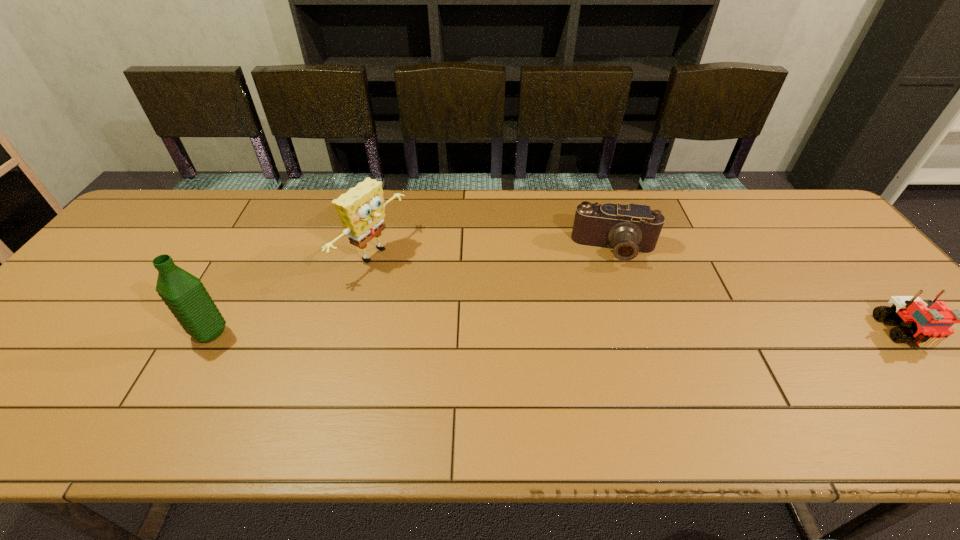
In order to click on water bottle in this screenshot , I will do `click(185, 295)`.

Where is `the rightmost object`? Image resolution: width=960 pixels, height=540 pixels. the rightmost object is located at coordinates (930, 323).

This screenshot has width=960, height=540. I want to click on the third object from left to right, so click(628, 229).

I want to click on the second object from left to right, so click(x=361, y=209).

Where is `vacant area situated 0.180m on the right of the water bottle`? This screenshot has height=540, width=960. vacant area situated 0.180m on the right of the water bottle is located at coordinates (x=303, y=333).

At what (x,y) coordinates should I click in order to perform the action: click on free space located on the front-facing side of the second object from right to left. Please return your answer as a coordinate pair (x, y). The height and width of the screenshot is (540, 960). Looking at the image, I should click on (612, 281).

At what (x,y) coordinates should I click in order to perform the action: click on free point located on the front-facing side of the second object from right to left. Please return your answer as a coordinate pair (x, y). Image resolution: width=960 pixels, height=540 pixels. Looking at the image, I should click on pos(613,392).

Locate an element on the screen. This screenshot has width=960, height=540. free space located on the front-facing side of the second object from right to left is located at coordinates (613, 376).

The height and width of the screenshot is (540, 960). Identify the location of vacant space located 0.360m on the face of the third object from right to left. (511, 328).

At what (x,y) coordinates should I click in order to perform the action: click on vacant space located on the face of the third object from right to left. Please return your answer as a coordinate pair (x, y). The height and width of the screenshot is (540, 960). Looking at the image, I should click on (473, 309).